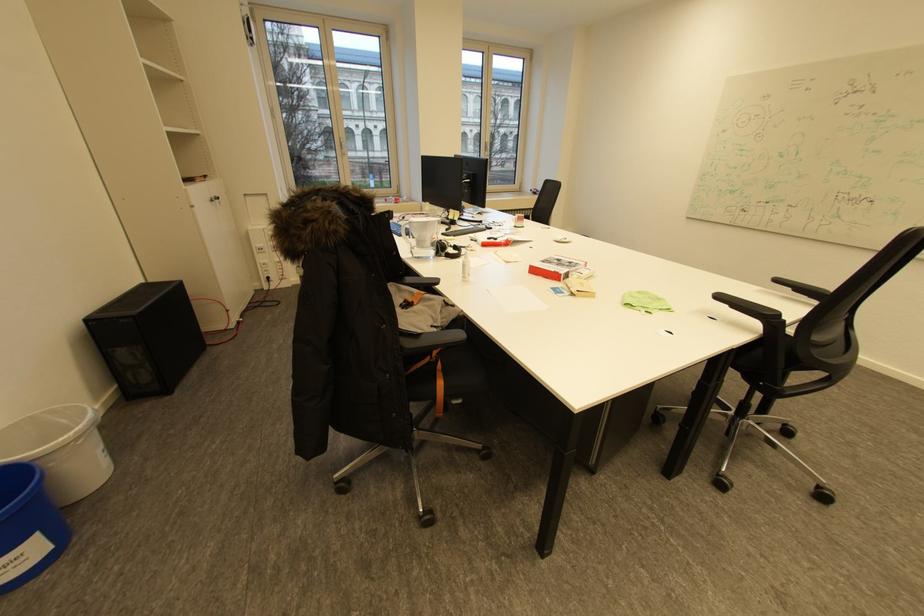
At what (x,y) coordinates should I click in order to perform the action: click on red cardboard box. Please return your answer as a coordinate pair (x, y). Image resolution: width=924 pixels, height=616 pixels. Looking at the image, I should click on (554, 267).